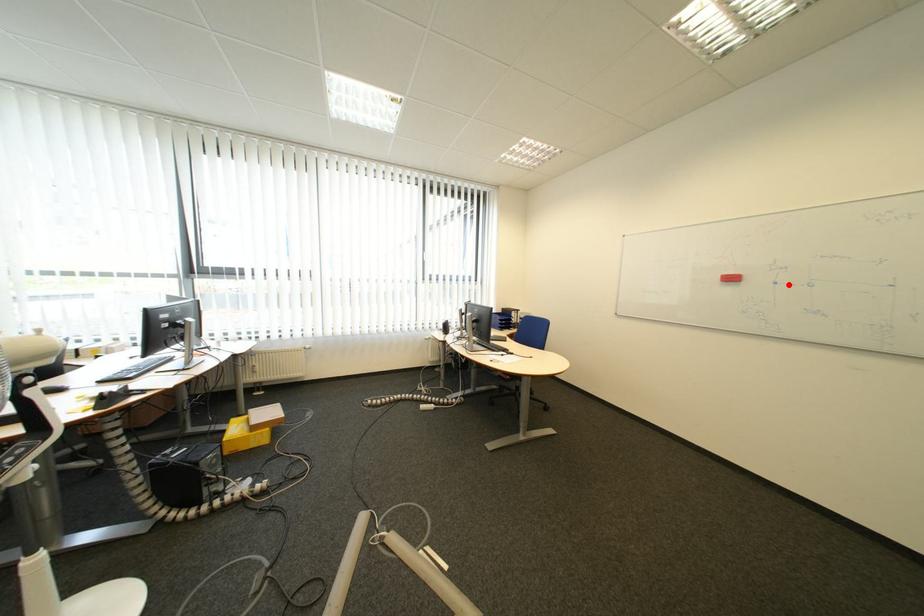
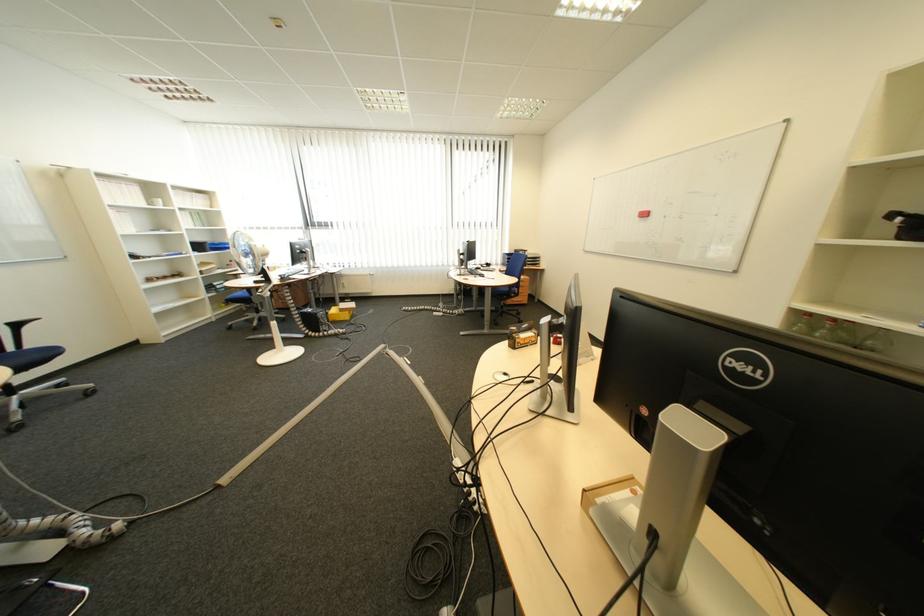
Where in the second image is the point corresponding to the highlighted location from the first image?

(677, 217)